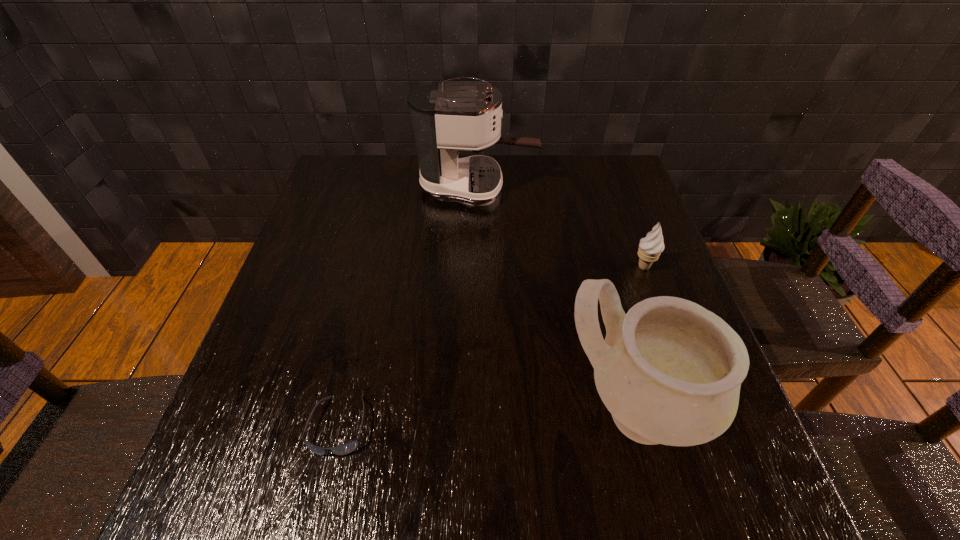
This screenshot has height=540, width=960. What are the coordinates of `vacant space that is in between the coffee maker and the pottery` in the screenshot? It's located at (554, 299).

Where is `the third closest object to the coffee maker`? This screenshot has height=540, width=960. the third closest object to the coffee maker is located at coordinates (346, 448).

At what (x,y) coordinates should I click in order to perform the action: click on object that is the third closest to the second farthest object. Please return your answer as a coordinate pair (x, y). The image size is (960, 540). Looking at the image, I should click on (346, 448).

Locate an element on the screen. The width and height of the screenshot is (960, 540). vacant region that satisfies the following two spatial constraints: 1. on the front-facing side of the coffee maker; 2. on the left side of the pottery is located at coordinates (475, 412).

Find the location of a particular element. blank area in the image that satisfies the following two spatial constraints: 1. on the front-facing side of the second farthest object; 2. on the lenses of the leftmost object is located at coordinates (702, 426).

Where is `free spot that satisfies the following two spatial constraints: 1. on the front-facing side of the second shortest object; 2. on the lenses of the sunglasses`? Image resolution: width=960 pixels, height=540 pixels. free spot that satisfies the following two spatial constraints: 1. on the front-facing side of the second shortest object; 2. on the lenses of the sunglasses is located at coordinates (702, 426).

Locate an element on the screen. This screenshot has height=540, width=960. free region that satisfies the following two spatial constraints: 1. on the front-facing side of the farthest object; 2. on the lenses of the shortest object is located at coordinates (475, 426).

Locate an element on the screen. free region that satisfies the following two spatial constraints: 1. on the front-facing side of the coffee maker; 2. on the right side of the pottery is located at coordinates (475, 412).

At what (x,y) coordinates should I click in order to perform the action: click on vacant space that satisfies the following two spatial constraints: 1. on the front-facing side of the pottery; 2. on the right side of the farthest object. Please return your answer as a coordinate pair (x, y). The image size is (960, 540). Looking at the image, I should click on (475, 412).

This screenshot has width=960, height=540. Identify the location of vacant area in the image that satisfies the following two spatial constraints: 1. on the front-facing side of the farthest object; 2. on the lenses of the leftmost object. (475, 426).